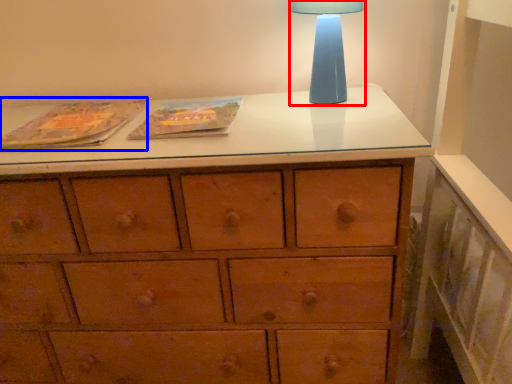
Question: Which of the following is the farthest to the observer, table lamp (highlighted by a red box) or paperback book (highlighted by a blue box)?

Choices:
 (A) table lamp
 (B) paperback book

Answer: (A)